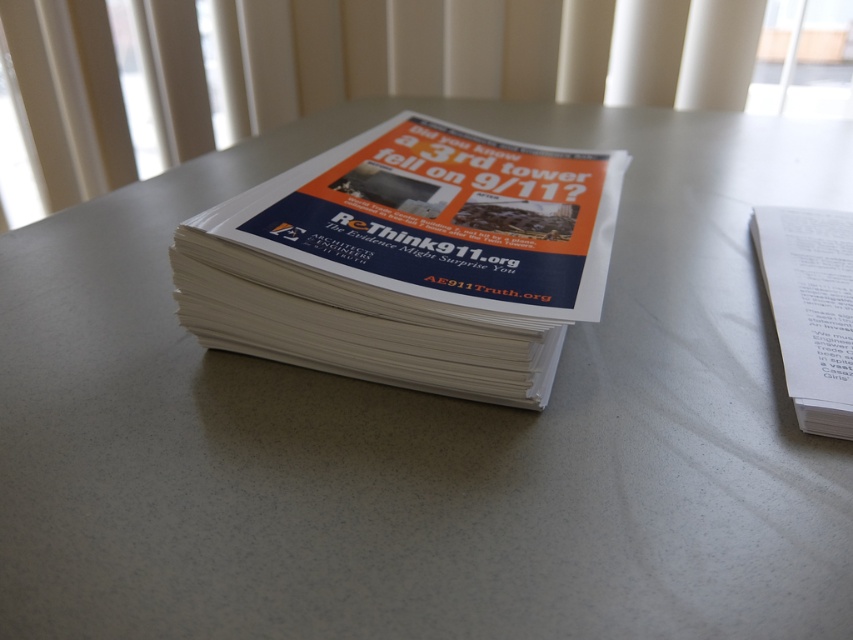
Is white paper flyer at center bigger than white paper at right?

Correct, white paper flyer at center is larger in size than white paper at right.

This screenshot has height=640, width=853. In order to click on white paper flyer at center in this screenshot , I will do `click(409, 260)`.